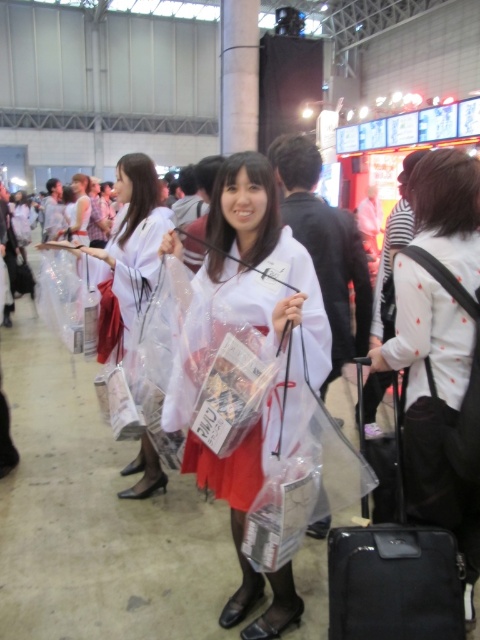
Question: Which of the following is the farthest from the observer?

Choices:
 (A) (139, 163)
 (B) (456, 301)

Answer: (A)

Question: Which point is closer to the camera taking this photo?

Choices:
 (A) (365, 577)
 (B) (245, 211)
 (C) (146, 291)
 (D) (469, 564)

Answer: (A)

Question: Which object appears farthest from the camera in this image?

Choices:
 (A) black synthetic suitcase at lower right
 (B) white matte kimono at center
 (C) white dotted shirt at center
 (D) white glossy kimono at center

Answer: (D)

Question: Where is white dotted shirt at center located in relation to black synthetic suitcase at lower right in the image?

Choices:
 (A) right
 (B) left

Answer: (A)

Question: Is white matte kimono at center further to the viewer compared to black synthetic suitcase at lower right?

Choices:
 (A) no
 (B) yes

Answer: (A)

Question: In this image, where is white dotted shirt at center located relative to white matte kimono at center?

Choices:
 (A) above
 (B) below

Answer: (A)